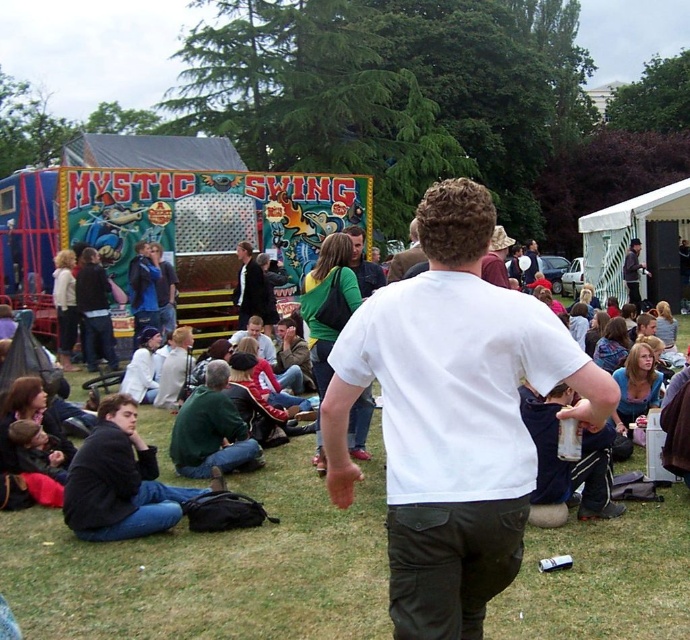
Can you confirm if dark green sweater at lower left is positioned below dark gray hoodie at center?

Indeed, dark green sweater at lower left is positioned under dark gray hoodie at center.

Which is behind, point (66, 518) or point (627, 298)?

Point (627, 298)

Measure the distance between point (128, 445) and camera.

They are 6.59 meters apart.

Find the location of `dark green sweater at lower left`. dark green sweater at lower left is located at coordinates (121, 481).

From the picture: Can you confirm if white matte t-shirt at center is smaller than dark green sweater at lower left?

Incorrect, white matte t-shirt at center is not smaller in size than dark green sweater at lower left.

Which is more to the left, white matte t-shirt at center or dark green sweater at lower left?

dark green sweater at lower left

The height and width of the screenshot is (640, 690). What do you see at coordinates (453, 417) in the screenshot?
I see `white matte t-shirt at center` at bounding box center [453, 417].

Where is `white matte t-shirt at center`? The height and width of the screenshot is (640, 690). white matte t-shirt at center is located at coordinates (453, 417).

Is green grass at center further to camera compared to dark gray hoodie at center?

No, green grass at center is in front of dark gray hoodie at center.

Does green grass at center appear on the right side of dark gray hoodie at center?

No, green grass at center is not to the right of dark gray hoodie at center.

Find the location of a particular element. The height and width of the screenshot is (640, 690). green grass at center is located at coordinates (213, 566).

Find the location of a particular element. green grass at center is located at coordinates 213,566.